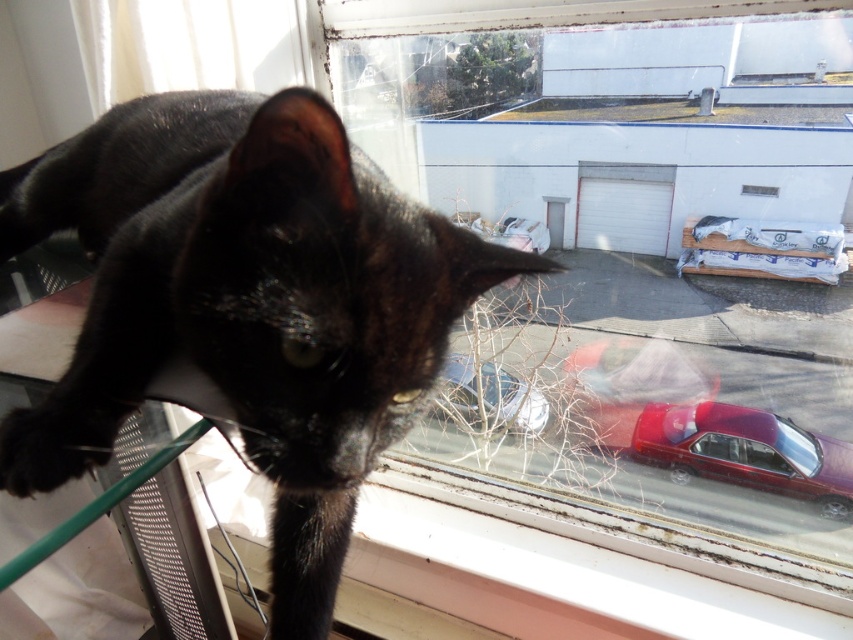
You are a delivery person trying to park your van in the driveway. You see the glossy red car at lower right and the metallic silver car at lower center. Which car is closer to the window where the cat is sitting?

The glossy red car at lower right is closer to the window where the cat is sitting because it is further to the viewer than the metallic silver car at lower center.

You are a photographer standing at the center of the room. You want to take a photo of the black glossy cat at upper left. Where should you position yourself relative to the window to ensure the cat is centered in your shot?

To center the black glossy cat at upper left in your photo, position yourself directly in line with the cat at point (x=247, y=304) relative to the window frame.